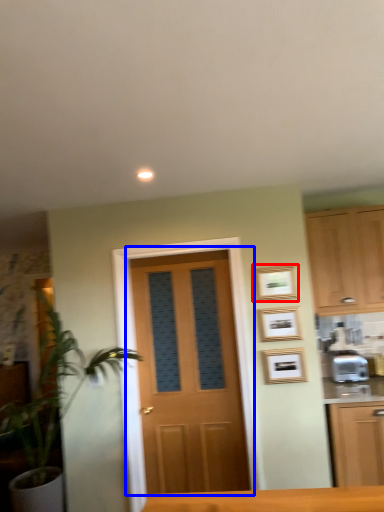
Question: Which point is further to the camera, picture frame (highlighted by a red box) or door (highlighted by a blue box)?

Choices:
 (A) picture frame
 (B) door

Answer: (B)